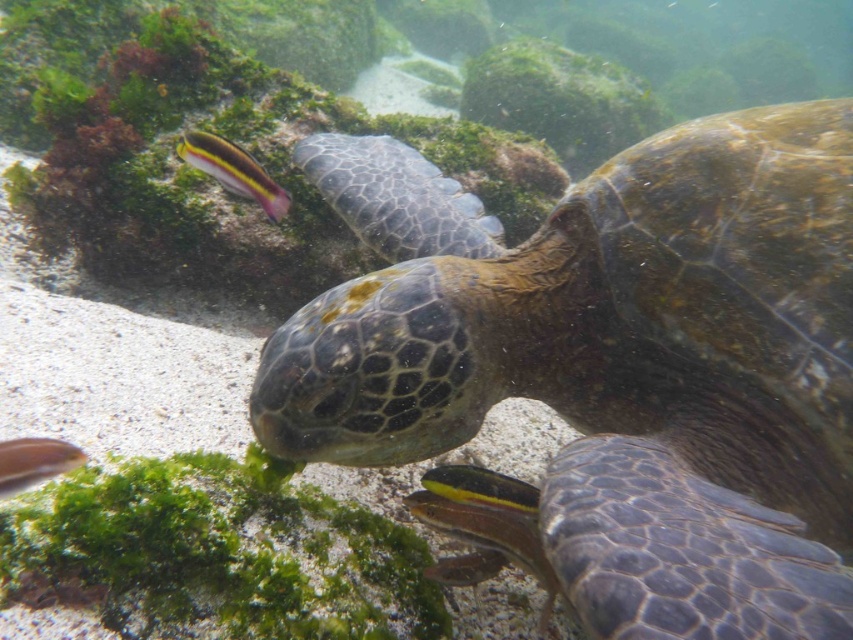
Question: Which of the following is the closest to the observer?

Choices:
 (A) leathery green turtle at center
 (B) yellow-green striped fish at upper left

Answer: (A)

Question: Is yellow-green striped fish at upper left in front of shiny silver fish at lower left?

Choices:
 (A) yes
 (B) no

Answer: (B)

Question: Among these objects, which one is nearest to the camera?

Choices:
 (A) shiny silver fish at lower left
 (B) leathery green turtle at center
 (C) yellow-green striped fish at upper left

Answer: (B)

Question: Is green matte algae at lower left to the right of yellow-green striped fish at upper left from the viewer's perspective?

Choices:
 (A) yes
 (B) no

Answer: (A)

Question: Does green matte algae at lower left appear over shiny silver fish at lower left?

Choices:
 (A) yes
 (B) no

Answer: (B)

Question: Which is nearer to the shiny silver fish at lower left?

Choices:
 (A) leathery green turtle at center
 (B) yellow-green striped fish at upper left
 (C) green matte algae at lower left

Answer: (C)